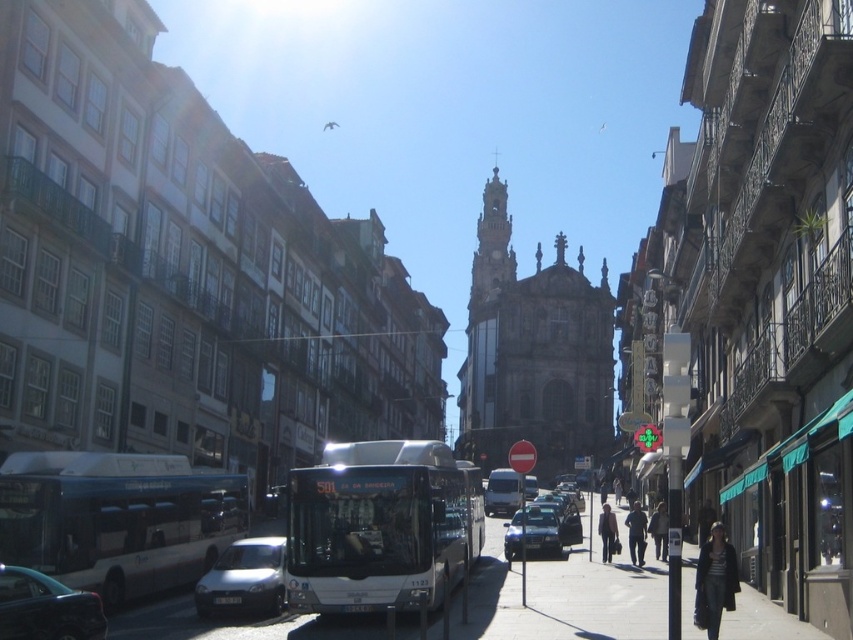
Is dark blue jeans at lower right in front of dark gray jacket at lower right?

Yes, it is.

Does dark blue jeans at lower right appear on the left side of dark gray jacket at lower right?

Yes, dark blue jeans at lower right is to the left of dark gray jacket at lower right.

Where is `dark blue jeans at lower right`? dark blue jeans at lower right is located at coordinates (636, 532).

Does white metallic bus at lower left appear on the left side of metallic silver sedan at center?

Indeed, white metallic bus at lower left is positioned on the left side of metallic silver sedan at center.

Can you confirm if white metallic bus at lower left is smaller than metallic silver sedan at center?

Incorrect, white metallic bus at lower left is not smaller in size than metallic silver sedan at center.

Which is behind, point (111, 595) or point (534, 512)?

The point (534, 512) is more distant.

Locate an element on the screen. The image size is (853, 640). white metallic bus at lower left is located at coordinates (117, 518).

Does shiny black sedan at lower left have a greater width compared to dark gray coat at center?

In fact, shiny black sedan at lower left might be narrower than dark gray coat at center.

Between shiny black sedan at lower left and dark gray coat at center, which one appears on the left side from the viewer's perspective?

Positioned to the left is shiny black sedan at lower left.

This screenshot has height=640, width=853. Describe the element at coordinates (45, 608) in the screenshot. I see `shiny black sedan at lower left` at that location.

Find the location of a particular element. shiny black sedan at lower left is located at coordinates (45, 608).